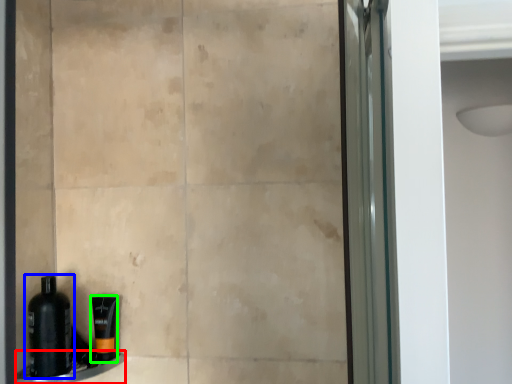
Question: Which object is positioned closest to ledge (highlighted by a red box)? Select from bottle (highlighted by a blue box) and toiletry (highlighted by a green box).

Choices:
 (A) bottle
 (B) toiletry

Answer: (B)